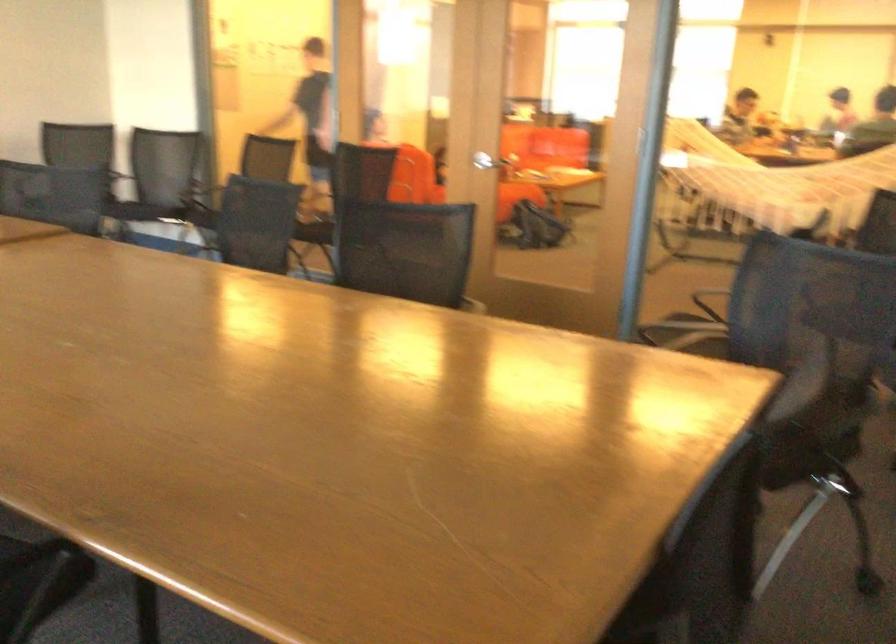
What do you see at coordinates (488, 162) in the screenshot?
I see `the silver door handle` at bounding box center [488, 162].